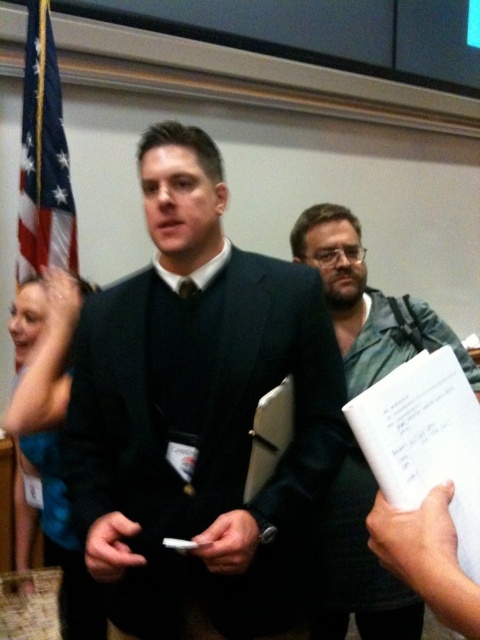
Does dark blue suit at center appear on the left side of green textured shirt at center?

Yes, dark blue suit at center is to the left of green textured shirt at center.

Who is shorter, dark blue suit at center or green textured shirt at center?

dark blue suit at center

Where is `dark blue suit at center`? The height and width of the screenshot is (640, 480). dark blue suit at center is located at coordinates (199, 413).